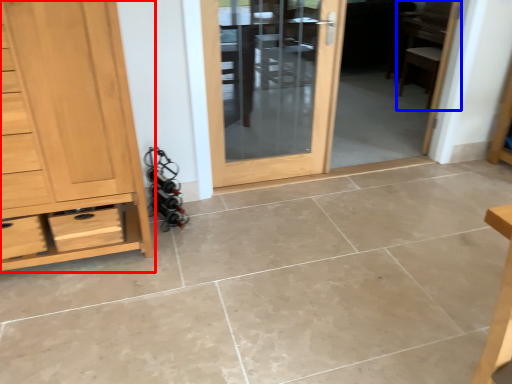
Question: Which of the following is the farthest to the observer, chest of drawers (highlighted by a red box) or chair (highlighted by a blue box)?

Choices:
 (A) chest of drawers
 (B) chair

Answer: (B)